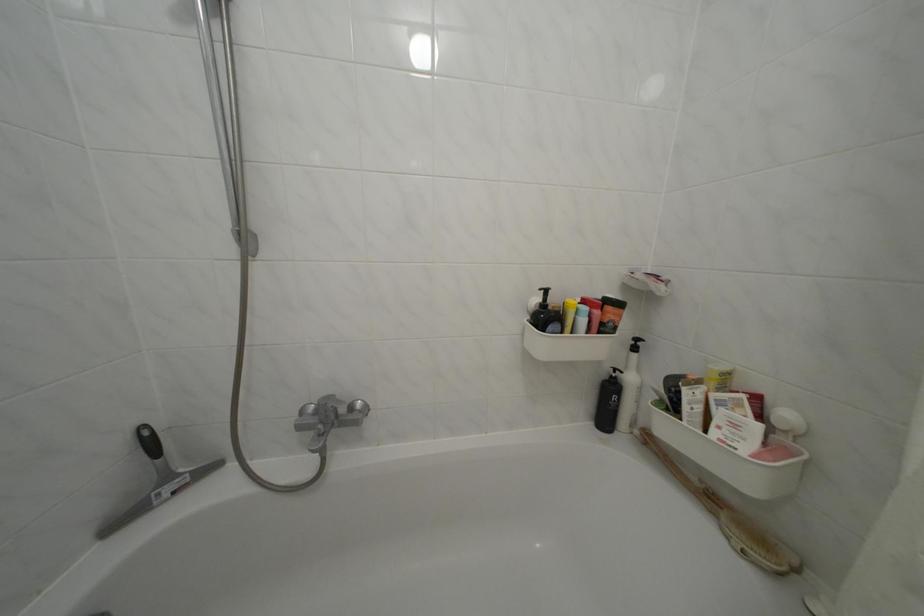
Describe the element at coordinates (322, 428) in the screenshot. I see `the faucet control lever` at that location.